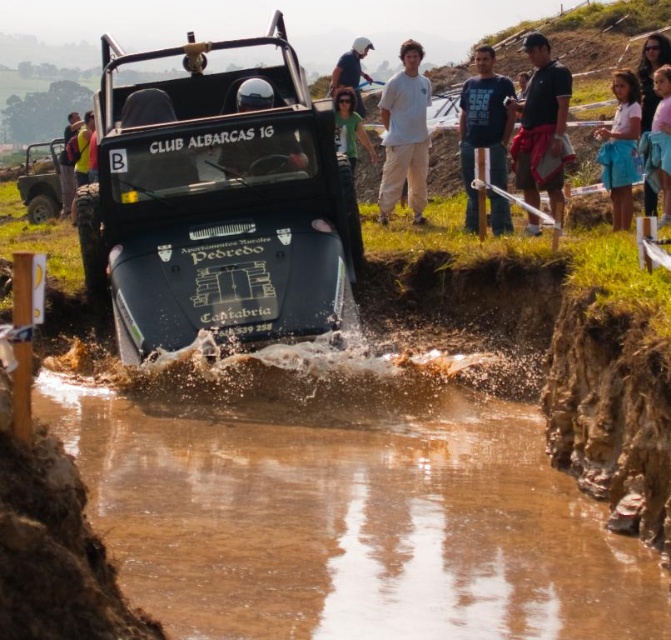
You are a drone operator trying to capture the best aerial shot of the offroad vehicle competition. You need to fly your drone from point A at coordinates point (293, 168) to point B at coordinates point (87, 182). According to the scene, which point is closer to the vehicle labeled CLUB ALBARCAS 1G?

Point (293, 168) is in front of point (87, 182), so it is closer to the vehicle labeled CLUB ALBARCAS 1G.